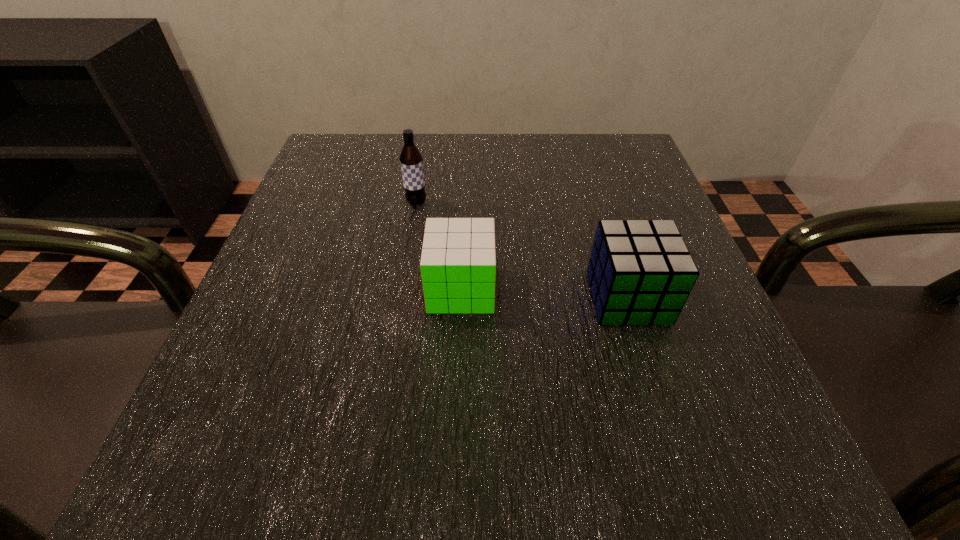
The width and height of the screenshot is (960, 540). I want to click on empty space that is in between the root beer and the rightmost object, so click(x=522, y=251).

Identify which object is located as the second nearest to the second object from left to right. Please provide its 2D coordinates. Your answer should be formatted as a tuple, i.e. [(x, y)], where the tuple contains the x and y coordinates of a point satisfying the conditions above.

[(411, 160)]

Identify the location of object that is the closest to the tallest object. This screenshot has width=960, height=540. (458, 262).

The image size is (960, 540). I want to click on free point that satisfies the following two spatial constraints: 1. on the front side of the farthest object; 2. on the right side of the left cube, so click(x=402, y=289).

Where is `free space that satisfies the following two spatial constraints: 1. on the front side of the tallest object; 2. on the left side of the rightmost object`? This screenshot has width=960, height=540. free space that satisfies the following two spatial constraints: 1. on the front side of the tallest object; 2. on the left side of the rightmost object is located at coordinates (401, 298).

This screenshot has width=960, height=540. I want to click on vacant space that satisfies the following two spatial constraints: 1. on the front side of the tallest object; 2. on the left side of the rightmost object, so click(x=401, y=298).

The height and width of the screenshot is (540, 960). Identify the location of vacant area in the image that satisfies the following two spatial constraints: 1. on the front side of the rightmost object; 2. on the left side of the leftmost object. (401, 298).